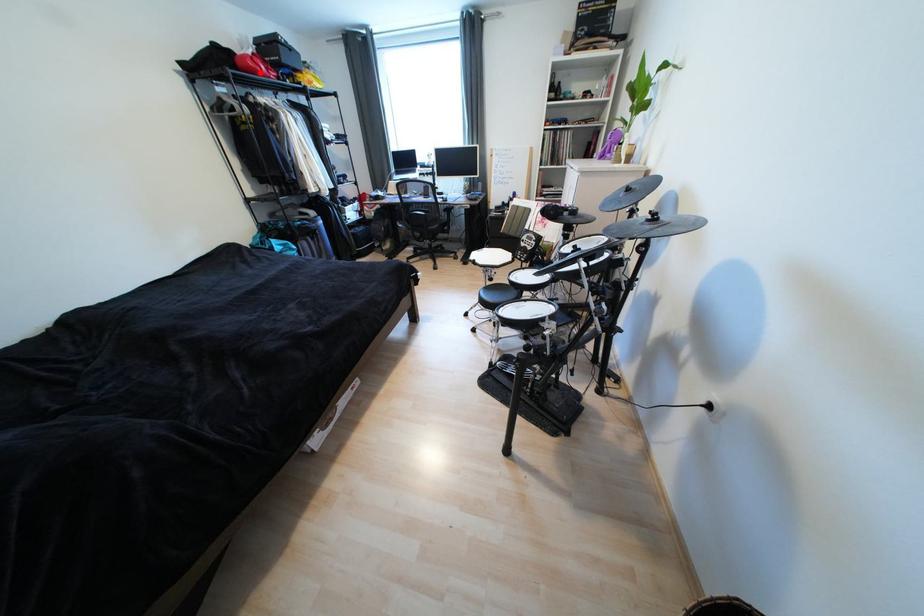
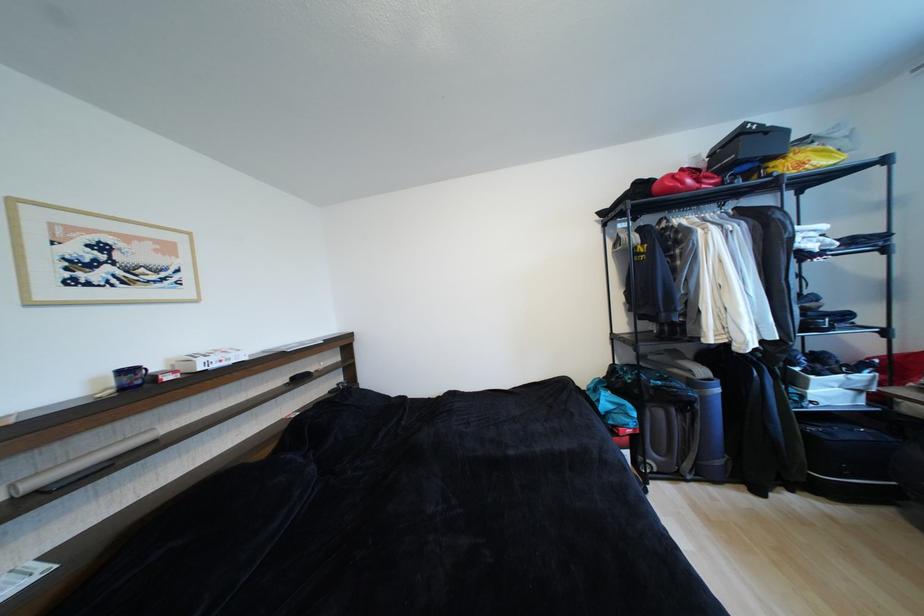
In the second image, find the point that corresponds to the highlighted location in the first image.

(676, 192)